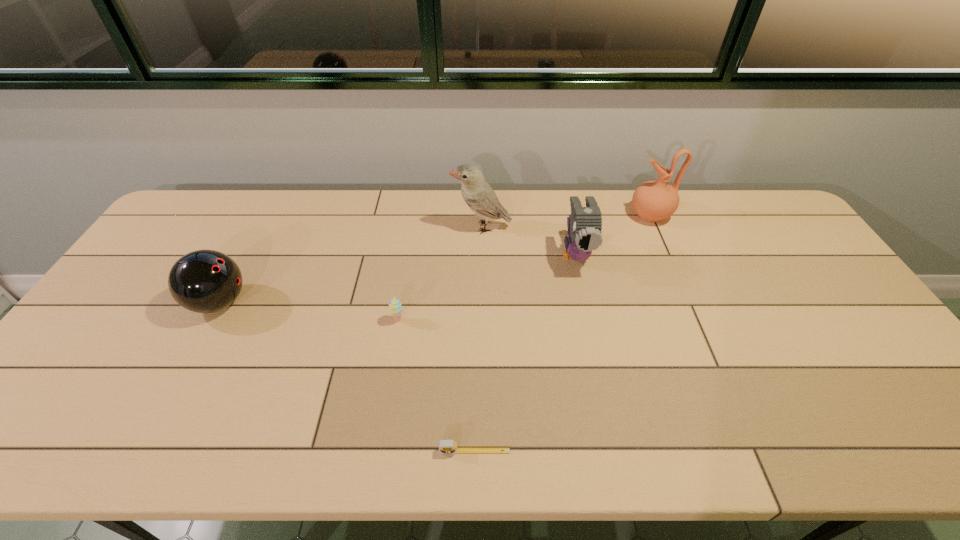
The width and height of the screenshot is (960, 540). Identify the location of free point between the bowling ball and the rightmost object. (435, 259).

This screenshot has width=960, height=540. I want to click on vacant point located between the bowling ball and the sherbert, so click(x=309, y=311).

The height and width of the screenshot is (540, 960). Identify the location of free point between the leftmost object and the shortest object. (348, 377).

Identify the location of object that is the nearest to the bowling ball. The height and width of the screenshot is (540, 960). (395, 307).

Select which object appears as the second closest to the shorter bird. Please provide its 2D coordinates. Your answer should be formatted as a tuple, i.e. [(x, y)], where the tuple contains the x and y coordinates of a point satisfying the conditions above.

[(653, 201)]

Identify the location of vacant space that satisfies the following two spatial constraints: 1. at the beak of the second object from right to left; 2. on the surface of the bowling ball near the finger holes. Image resolution: width=960 pixels, height=540 pixels. (587, 302).

Where is `vacant space that satisfies the following two spatial constraints: 1. at the beak of the right bird; 2. on the surface of the leftmost object near the finger holes`? This screenshot has width=960, height=540. vacant space that satisfies the following two spatial constraints: 1. at the beak of the right bird; 2. on the surface of the leftmost object near the finger holes is located at coordinates (587, 302).

Image resolution: width=960 pixels, height=540 pixels. Identify the location of free space that satisfies the following two spatial constraints: 1. on the spout of the rightmost object; 2. at the front of the shortest object with the tape extended. (753, 451).

Locate an element on the screen. The image size is (960, 540). free space that satisfies the following two spatial constraints: 1. on the surface of the sherbert near the finger holes; 2. on the left side of the bowling ball is located at coordinates (210, 320).